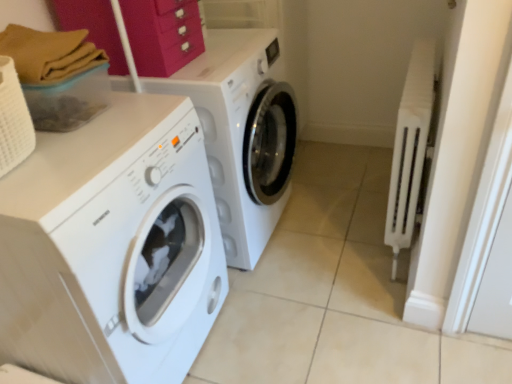
At what (x,y) coordinates should I click in order to perform the action: click on blank space above white plastic radiator at right (from a real-world perspective). Please return your answer as a coordinate pair (x, y). This screenshot has width=512, height=384. Looking at the image, I should click on (419, 67).